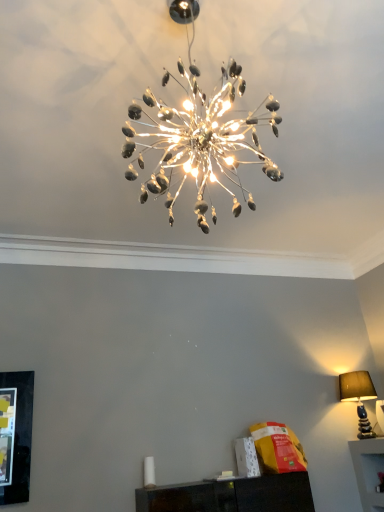
Question: From the image's perspective, is matte brown lampshade at right, the second lamp positioned from the top, below metallic silver chandelier at center, which is counted as the second lamp, starting from the right?

Choices:
 (A) yes
 (B) no

Answer: (A)

Question: From a real-world perspective, is matte brown lampshade at right, which appears as the 2th lamp when viewed from the front, physically below metallic silver chandelier at center, placed as the second lamp when sorted from back to front?

Choices:
 (A) yes
 (B) no

Answer: (A)

Question: Is matte brown lampshade at right, which appears as the 2th lamp when viewed from the front, outside of metallic silver chandelier at center, which is the 1th lamp from top to bottom?

Choices:
 (A) yes
 (B) no

Answer: (A)

Question: Does matte brown lampshade at right, which appears as the 2th lamp when viewed from the front, have a lesser width compared to metallic silver chandelier at center, which is counted as the second lamp, starting from the right?

Choices:
 (A) no
 (B) yes

Answer: (B)

Question: Does matte brown lampshade at right, marked as the first lamp in a right-to-left arrangement, appear on the right side of metallic silver chandelier at center, which appears as the 2th lamp when ordered from the bottom?

Choices:
 (A) yes
 (B) no

Answer: (A)

Question: Does matte brown lampshade at right, the second lamp positioned from the top, appear on the left side of metallic silver chandelier at center, which ranks as the 1th lamp in left-to-right order?

Choices:
 (A) yes
 (B) no

Answer: (B)

Question: From a real-world perspective, is metallic silver chandelier at center, which appears as the 2th lamp when ordered from the bottom, on top of matte brown lampshade at right, which is the first lamp in bottom-to-top order?

Choices:
 (A) no
 (B) yes

Answer: (B)

Question: Does metallic silver chandelier at center, which is the 1th lamp from top to bottom, have a lesser height compared to matte brown lampshade at right, which is the 2th lamp in left-to-right order?

Choices:
 (A) yes
 (B) no

Answer: (B)

Question: Does metallic silver chandelier at center, which is counted as the first lamp, starting from the front, come behind matte brown lampshade at right, the second lamp positioned from the top?

Choices:
 (A) yes
 (B) no

Answer: (B)

Question: Does metallic silver chandelier at center, which appears as the 2th lamp when ordered from the bottom, lie in front of matte brown lampshade at right, which is the 2th lamp in left-to-right order?

Choices:
 (A) yes
 (B) no

Answer: (A)

Question: Does metallic silver chandelier at center, which is counted as the second lamp, starting from the right, have a smaller size compared to matte brown lampshade at right, positioned as the 1th lamp in back-to-front order?

Choices:
 (A) yes
 (B) no

Answer: (B)

Question: Is matte brown lampshade at right, which is the first lamp in bottom-to-top order, at the back of metallic silver chandelier at center, which is the 1th lamp from top to bottom?

Choices:
 (A) no
 (B) yes

Answer: (A)

Question: In terms of height, does matte brown lampshade at right, which appears as the 2th lamp when viewed from the front, look taller or shorter compared to metallic silver chandelier at center, which appears as the 2th lamp when ordered from the bottom?

Choices:
 (A) short
 (B) tall

Answer: (A)